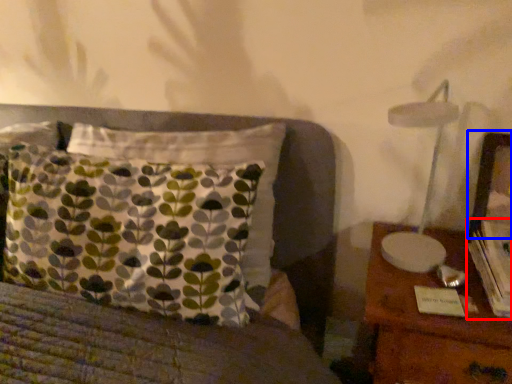
Question: Which object is further to the camera taking this photo, book (highlighted by a red box) or picture frame (highlighted by a blue box)?

Choices:
 (A) book
 (B) picture frame

Answer: (B)